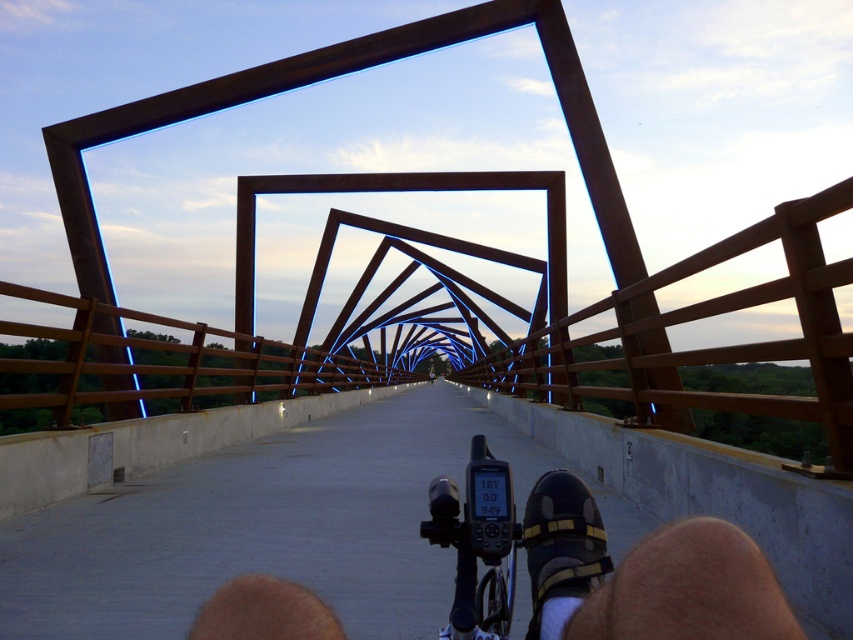
Does black plastic gps at center appear on the left side of black matte shoe at lower center?

Correct, you'll find black plastic gps at center to the left of black matte shoe at lower center.

Based on the photo, who is lower down, black plastic gps at center or black matte shoe at lower center?

black matte shoe at lower center

Identify the location of black plastic gps at center. (477, 544).

Describe the element at coordinates (445, 228) in the screenshot. I see `brown metallic bridge at center` at that location.

At what (x,y) coordinates should I click in order to perform the action: click on brown metallic bridge at center. Please return your answer as a coordinate pair (x, y). This screenshot has height=640, width=853. Looking at the image, I should click on (445, 228).

Can you confirm if black matte shoe at center is wider than black plastic gps at center?

Yes, black matte shoe at center is wider than black plastic gps at center.

Between black matte shoe at center and black plastic gps at center, which one is positioned higher?

black matte shoe at center

You are a GUI agent. You are given a task and a screenshot of the screen. Output one action in this format:
    pyautogui.click(x=<x>, y=<y>)
    Task: Click on the black matte shoe at center
    
    Given the screenshot: What is the action you would take?
    pyautogui.click(x=647, y=577)

Identify the location of black matte shoe at center. The height and width of the screenshot is (640, 853). (647, 577).